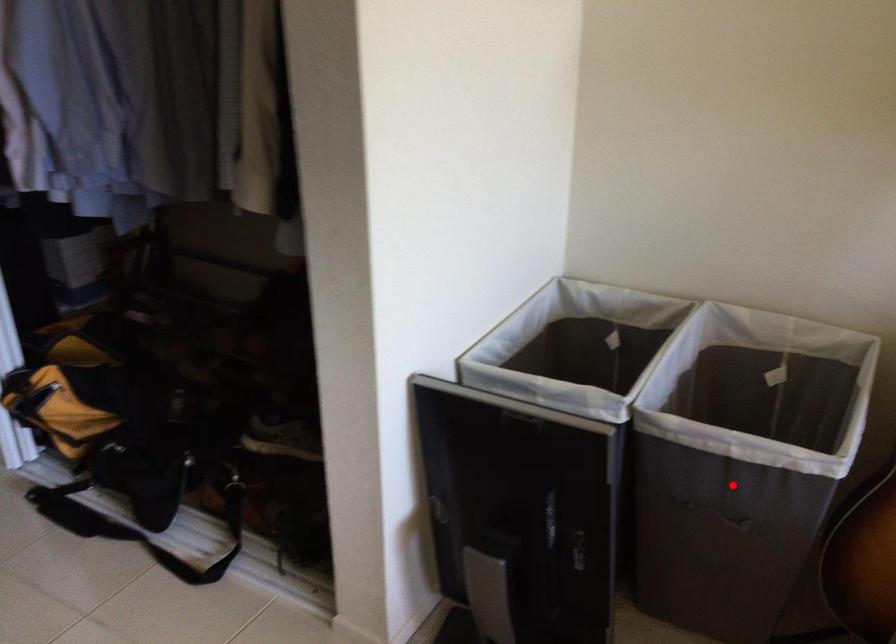
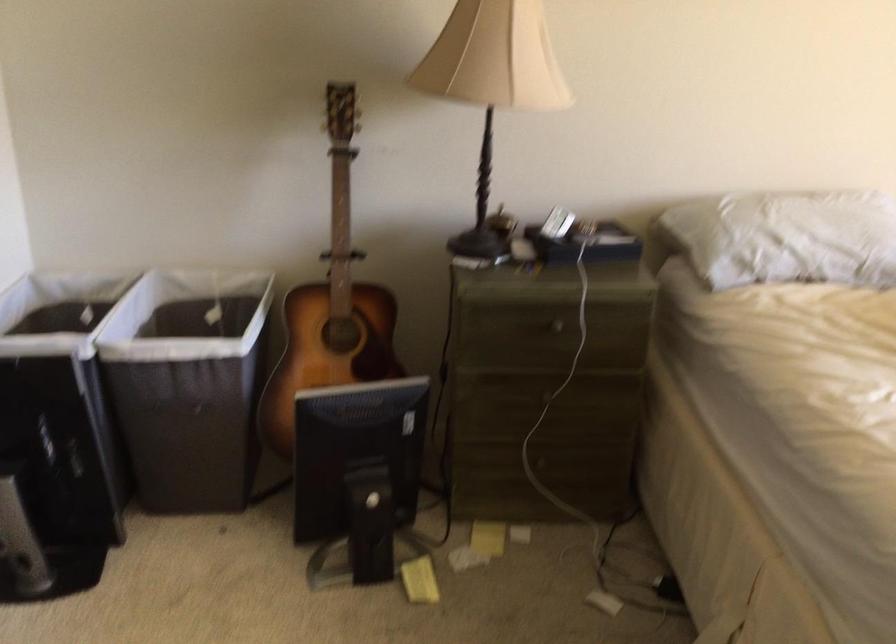
The point at the highlighted location is marked in the first image. Where is the corresponding point in the second image?

(188, 384)